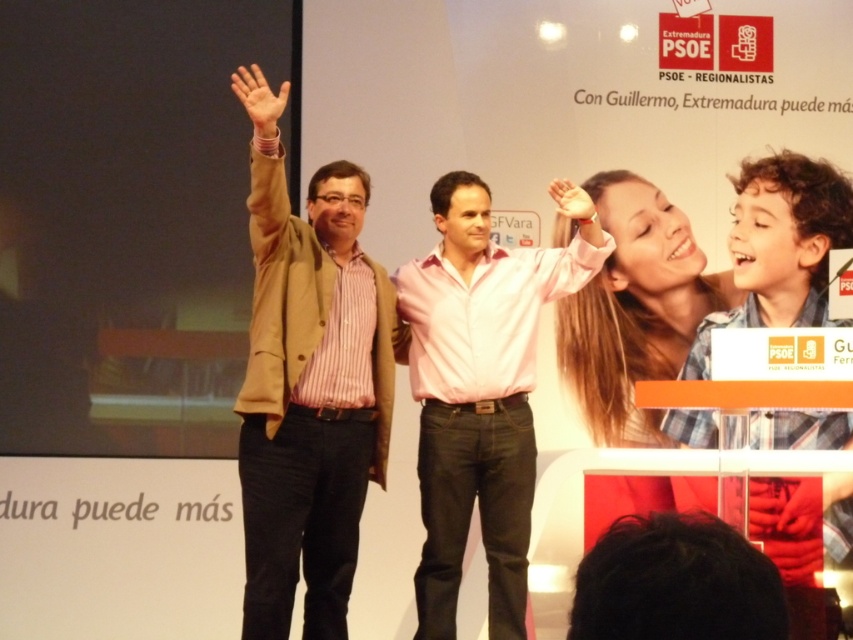
Question: Does matte brown jacket at center have a smaller size compared to pink cotton shirt at center?

Choices:
 (A) no
 (B) yes

Answer: (A)

Question: Is matte brown jacket at center further to the viewer compared to pink cotton shirt at center?

Choices:
 (A) yes
 (B) no

Answer: (B)

Question: Which of the following is the closest to the observer?

Choices:
 (A) pink cotton shirt at center
 (B) matte brown jacket at center

Answer: (B)

Question: Among these objects, which one is farthest from the camera?

Choices:
 (A) pink cotton shirt at center
 (B) matte brown jacket at center

Answer: (A)

Question: Is matte brown jacket at center to the left of pink cotton shirt at center from the viewer's perspective?

Choices:
 (A) no
 (B) yes

Answer: (B)